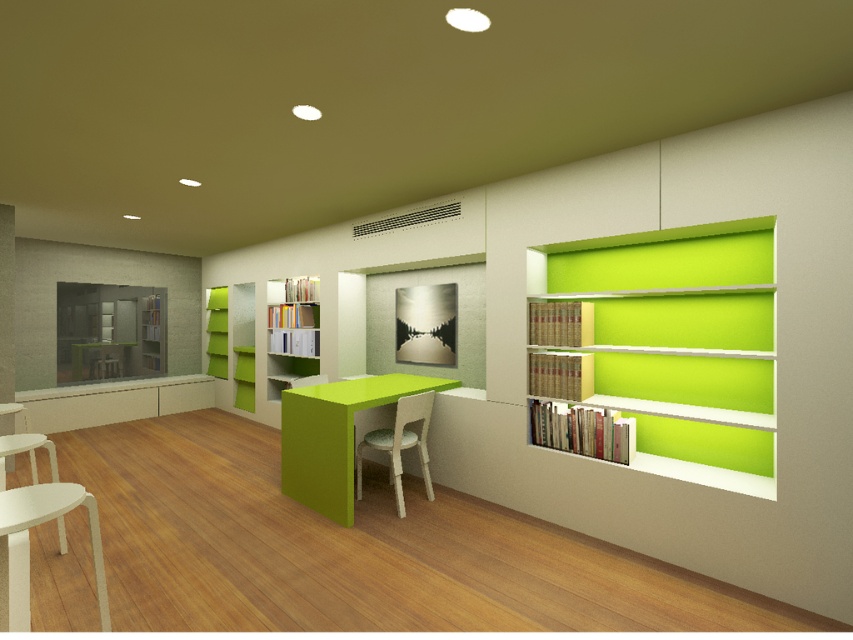
Question: Among these points, which one is farthest from the camera?

Choices:
 (A) (35, 490)
 (B) (312, 378)
 (C) (737, 342)
 (D) (316, 456)

Answer: (B)

Question: Among these points, which one is nearest to the camera?

Choices:
 (A) (326, 444)
 (B) (750, 464)

Answer: (B)

Question: Is white textured chair at center further to the viewer compared to green matte bookcase at left?

Choices:
 (A) yes
 (B) no

Answer: (B)

Question: Is matte white bookcase at center bigger than white textured chair at center?

Choices:
 (A) no
 (B) yes

Answer: (B)

Question: Which of these objects is positioned closest to the lime green matte bookcase at right?

Choices:
 (A) matte white bookcase at center
 (B) matte green table at center

Answer: (B)

Question: From the image, what is the correct spatial relationship of lime green matte bookcase at right in relation to matte green table at center?

Choices:
 (A) above
 (B) below

Answer: (A)